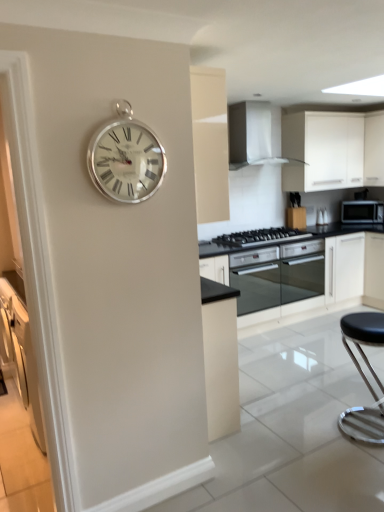
What do you see at coordinates (278, 275) in the screenshot? This screenshot has height=512, width=384. I see `black glass oven at center, positioned as the second oven in left-to-right order` at bounding box center [278, 275].

Find the location of a particular element. silver metallic clock at upper left is located at coordinates (126, 158).

Image resolution: width=384 pixels, height=512 pixels. Identify the location of black matte microwave at right. (362, 212).

From the image's perspective, is silver metallic clock at upper left on black glass oven at center, placed as the first oven when sorted from left to right?

Yes, from the image's perspective, silver metallic clock at upper left is above black glass oven at center, placed as the first oven when sorted from left to right.

Can you tell me how much silver metallic clock at upper left and black glass oven at center, the second oven viewed from the right, differ in facing direction?

The facing directions of silver metallic clock at upper left and black glass oven at center, the second oven viewed from the right, are 0.661 degrees apart.

Is silver metallic clock at upper left oriented away from black glass oven at center, the second oven viewed from the right?

No, black glass oven at center, the second oven viewed from the right, is not at the back of silver metallic clock at upper left.

Can you confirm if silver metallic clock at upper left is thinner than black glass oven at center, the second oven viewed from the right?

Indeed, silver metallic clock at upper left has a lesser width compared to black glass oven at center, the second oven viewed from the right.

From a real-world perspective, who is located higher, white matte cabinet at upper right or black matte microwave at right?

white matte cabinet at upper right, from a real-world perspective.

Considering the positions of point (329, 137) and point (367, 202), is point (329, 137) closer or farther from the camera than point (367, 202)?

Clearly, point (329, 137) is closer to the camera than point (367, 202).

Which object is positioned more to the left, white matte cabinet at upper right or black matte microwave at right?

white matte cabinet at upper right is more to the left.

Does white matte cabinet at upper right have a larger size compared to black matte microwave at right?

Indeed, white matte cabinet at upper right has a larger size compared to black matte microwave at right.

Is white glossy range hood at upper center thinner than silver metallic clock at upper left?

In fact, white glossy range hood at upper center might be wider than silver metallic clock at upper left.

Considering the positions of objects white glossy range hood at upper center and silver metallic clock at upper left in the image provided, who is in front, white glossy range hood at upper center or silver metallic clock at upper left?

silver metallic clock at upper left is in front.

Which object is positioned more to the right, white glossy range hood at upper center or silver metallic clock at upper left?

From the viewer's perspective, white glossy range hood at upper center appears more on the right side.

From a real-world perspective, between silver metallic clock at upper left and black glass oven at center, positioned as the second oven in left-to-right order, who is vertically lower?

black glass oven at center, positioned as the second oven in left-to-right order, from a real-world perspective.

Does point (124, 112) appear closer or farther from the camera than point (263, 275)?

Point (124, 112) is closer to the camera than point (263, 275).

Is silver metallic clock at upper left to the left of black glass oven at center, acting as the 1th oven starting from the right, from the viewer's perspective?

Correct, you'll find silver metallic clock at upper left to the left of black glass oven at center, acting as the 1th oven starting from the right.

Is silver metallic clock at upper left oriented towards black glass oven at center, acting as the 1th oven starting from the right?

No, silver metallic clock at upper left is not oriented towards black glass oven at center, acting as the 1th oven starting from the right.

Do you think white glossy range hood at upper center is within black glass oven at center, placed as the first oven when sorted from left to right, or outside of it?

white glossy range hood at upper center cannot be found inside black glass oven at center, placed as the first oven when sorted from left to right.

Is white glossy range hood at upper center oriented towards black glass oven at center, the second oven viewed from the right?

No.

Does point (271, 153) come behind point (238, 258)?

Yes, it is behind point (238, 258).

In the scene shown: Which is in front, white glossy range hood at upper center or black glass oven at center, placed as the first oven when sorted from left to right?

Positioned in front is white glossy range hood at upper center.

Considering the sizes of objects black leather stool at lower right and white glossy range hood at upper center in the image provided, who is bigger, black leather stool at lower right or white glossy range hood at upper center?

With larger size is white glossy range hood at upper center.

In the scene shown: How many degrees apart are the facing directions of black leather stool at lower right and white glossy range hood at upper center?

The facing directions of black leather stool at lower right and white glossy range hood at upper center are 2.45 degrees apart.

From a real-world perspective, is black leather stool at lower right below white glossy range hood at upper center?

Yes.

The width and height of the screenshot is (384, 512). I want to click on gas stove that is below the white matte cabinet at upper right (from the image's perspective), so click(x=260, y=237).

Which is behind, point (306, 139) or point (289, 231)?

The point (289, 231) is farther from the camera.

Considering the positions of objects white matte cabinet at upper right and black glass gas stove at center in the image provided, who is in front, white matte cabinet at upper right or black glass gas stove at center?

black glass gas stove at center.

Locate an element on the screen. the 1st oven to the right of the silver metallic clock at upper left, counting from the anchor's position is located at coordinates (256, 279).

Find the location of a particular element. This screenshot has width=384, height=512. microwave oven below the white matte cabinet at upper right (from a real-world perspective) is located at coordinates (362, 212).

From the image, which object appears to be nearer to black glass oven at center, the second oven viewed from the right, black glass gas stove at center or silver metallic clock at upper left?

black glass gas stove at center is positioned closer to the anchor black glass oven at center, the second oven viewed from the right.

Considering their positions, is black glass oven at center, placed as the first oven when sorted from left to right, positioned closer to black leather stool at lower right than black glass oven at center, acting as the 1th oven starting from the right?

black glass oven at center, acting as the 1th oven starting from the right, is closer to black leather stool at lower right.

When comparing their distances from white matte cabinet at upper right, does black leather stool at lower right or black matte microwave at right seem closer?

black matte microwave at right is closer to white matte cabinet at upper right.

Considering their positions, is silver metallic clock at upper left positioned closer to white matte cabinet at upper right than black leather stool at lower right?

black leather stool at lower right is closer to white matte cabinet at upper right.

Considering their positions, is black matte microwave at right positioned further to black glass oven at center, acting as the 1th oven starting from the right, than silver metallic clock at upper left?

Based on the image, silver metallic clock at upper left appears to be further to black glass oven at center, acting as the 1th oven starting from the right.

Which object lies further to the anchor point black glass oven at center, acting as the 1th oven starting from the right, white matte cabinet at upper right or white glossy range hood at upper center?

Based on the image, white glossy range hood at upper center appears to be further to black glass oven at center, acting as the 1th oven starting from the right.

Which object lies further to the anchor point black leather stool at lower right, silver metallic clock at upper left or black glass oven at center, positioned as the second oven in left-to-right order?

silver metallic clock at upper left.

When comparing their distances from black glass gas stove at center, does white glossy range hood at upper center or black matte microwave at right seem closer?

Among the two, white glossy range hood at upper center is located nearer to black glass gas stove at center.

Find the location of a particular element. gas stove between white glossy range hood at upper center and black leather stool at lower right vertically is located at coordinates (260, 237).

Locate an element on the screen. This screenshot has height=512, width=384. home appliance located between silver metallic clock at upper left and black glass oven at center, placed as the first oven when sorted from left to right, in the depth direction is located at coordinates (252, 136).

Image resolution: width=384 pixels, height=512 pixels. Find the location of `cabinetry situated between black glass gas stove at center and black matte microwave at right from left to right`. cabinetry situated between black glass gas stove at center and black matte microwave at right from left to right is located at coordinates 332,150.

Find the location of a particular element. home appliance between silver metallic clock at upper left and black matte microwave at right in the front-back direction is located at coordinates (252, 136).